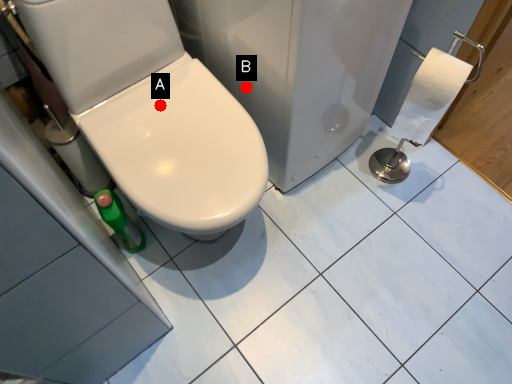
Question: Two points are circled on the image, labeled by A and B beside each circle. Which point is farther from the camera taking this photo?

Choices:
 (A) A is further
 (B) B is further

Answer: (B)